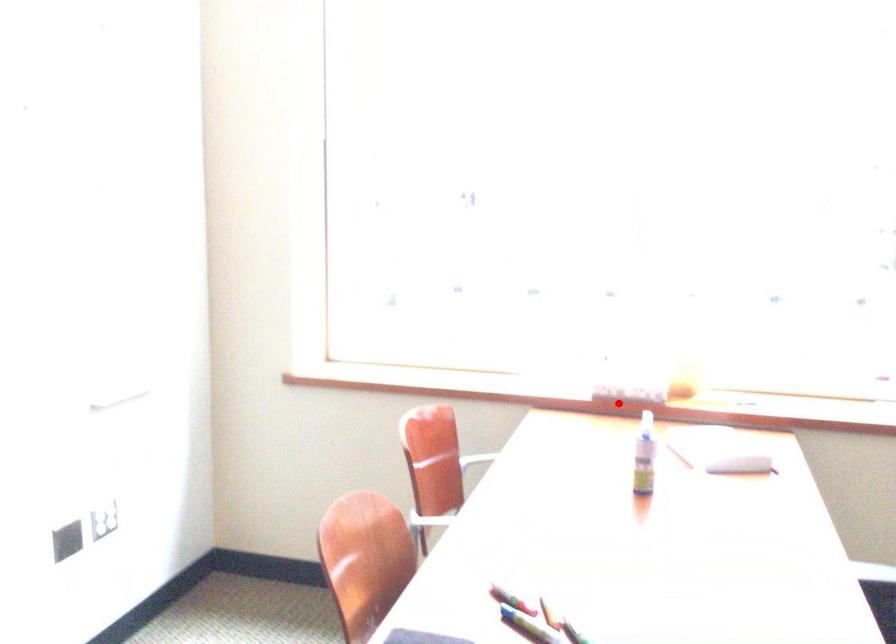
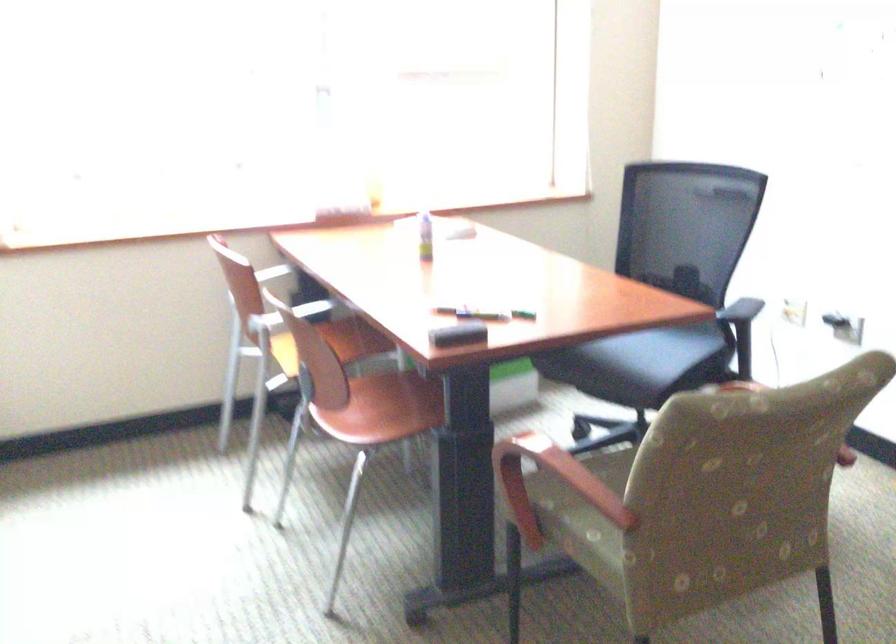
The point at the highlighted location is marked in the first image. Where is the corresponding point in the second image?

(346, 214)